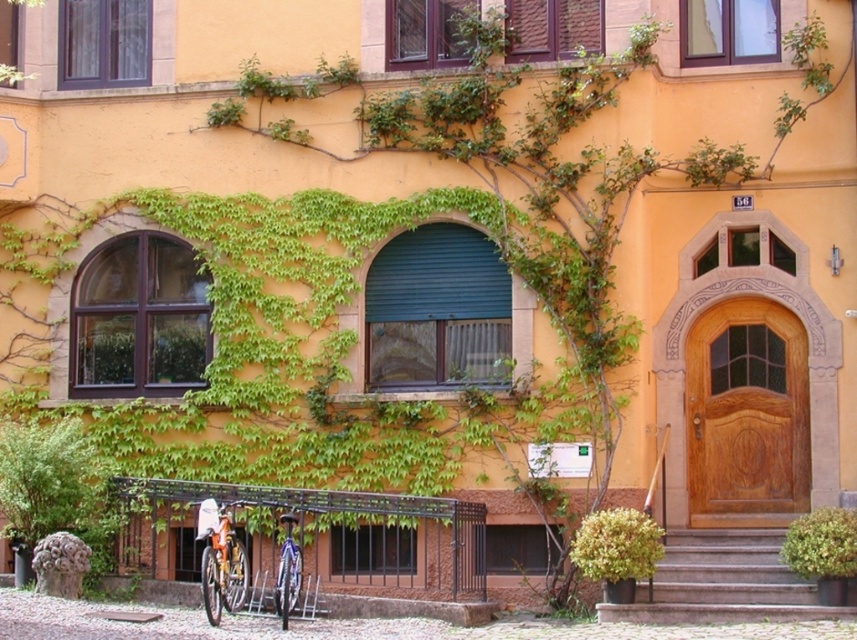
Is matte white shutter at upper left positioned behind wooden at upper center?

Yes, it is.

Can you confirm if matte white shutter at upper left is thinner than wooden at upper center?

In fact, matte white shutter at upper left might be wider than wooden at upper center.

Image resolution: width=857 pixels, height=640 pixels. What do you see at coordinates (105, 42) in the screenshot? I see `matte white shutter at upper left` at bounding box center [105, 42].

Locate an element on the screen. matte white shutter at upper left is located at coordinates (105, 42).

Does green matte shutter at center appear on the right side of green leafy bush at lower right?

Incorrect, green matte shutter at center is not on the right side of green leafy bush at lower right.

Describe the element at coordinates (436, 308) in the screenshot. I see `green matte shutter at center` at that location.

Identify the location of green matte shutter at center. (436, 308).

Which is below, orange matte bicycle at lower left or green leafy bush at lower right?

orange matte bicycle at lower left is lower down.

Between point (217, 509) and point (838, 550), which one is positioned in front?

Point (838, 550) is more forward.

Is point (228, 508) positioned in front of point (836, 554)?

No.

Identify the location of orange matte bicycle at lower left. The width and height of the screenshot is (857, 640). (220, 560).